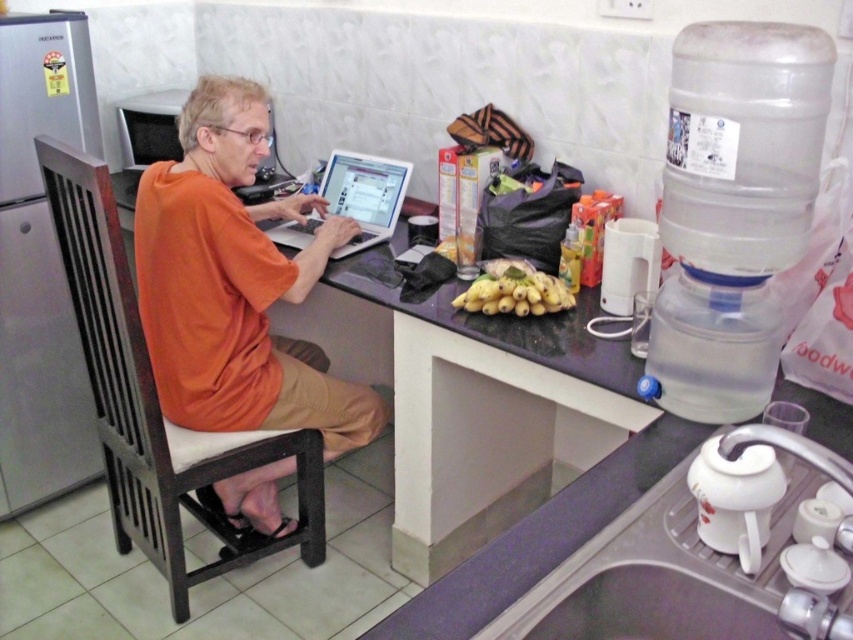
Question: Considering the relative positions of orange cotton shirt at center and yellow matte bananas at center in the image provided, where is orange cotton shirt at center located with respect to yellow matte bananas at center?

Choices:
 (A) left
 (B) right

Answer: (A)

Question: Which point is closer to the camera?

Choices:
 (A) brown wood chair at left
 (B) orange cotton shirt at center
 (C) silver metallic laptop at center
 (D) white ceramic sink at lower right

Answer: (D)

Question: Which of these objects is positioned closest to the brown wood chair at left?

Choices:
 (A) white ceramic sink at lower right
 (B) purple laminate counter at center
 (C) silver metallic laptop at center

Answer: (B)

Question: Is silver metallic laptop at center above yellow matte bananas at center?

Choices:
 (A) yes
 (B) no

Answer: (A)

Question: Does orange cotton shirt at center appear on the right side of silver metallic laptop at center?

Choices:
 (A) no
 (B) yes

Answer: (A)

Question: Which object is closer to the camera taking this photo?

Choices:
 (A) white ceramic sink at lower right
 (B) yellow matte bananas at center
 (C) brown wood chair at left
 (D) orange cotton shirt at center

Answer: (A)